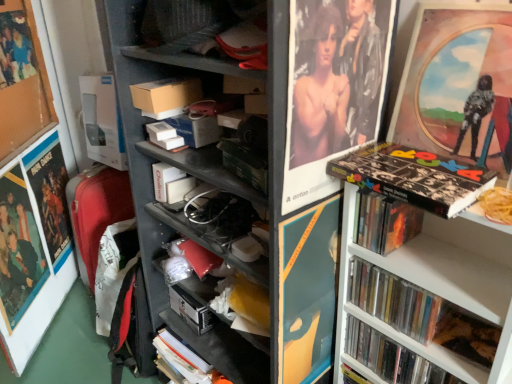
Question: Is black matte book at upper right, the third book viewed from the left, thinner than metallic silver cd case at right, positioned as the 2th book in right-to-left order?

Choices:
 (A) no
 (B) yes

Answer: (A)

Question: Can you confirm if black matte book at upper right, the third book viewed from the left, is shorter than metallic silver cd case at right, positioned as the 2th book in right-to-left order?

Choices:
 (A) no
 (B) yes

Answer: (B)

Question: Is black matte book at upper right, arranged as the 3th book when viewed from the right, wider than metallic silver cd case at right, positioned as the 2th book in right-to-left order?

Choices:
 (A) no
 (B) yes

Answer: (B)

Question: Is black matte book at upper right, the third book viewed from the left, looking in the opposite direction of metallic silver cd case at right, the 4th book in the left-to-right sequence?

Choices:
 (A) no
 (B) yes

Answer: (A)

Question: Is black matte book at upper right, the third book viewed from the left, with metallic silver cd case at right, the 4th book in the left-to-right sequence?

Choices:
 (A) no
 (B) yes

Answer: (A)

Question: Is black matte book at upper right, the third book viewed from the left, to the left or to the right of black matte book at lower right, which is the first book in right-to-left order, in the image?

Choices:
 (A) right
 (B) left

Answer: (B)

Question: Would you say black matte book at upper right, arranged as the 3th book when viewed from the right, is inside or outside black matte book at lower right, arranged as the fifth book when viewed from the left?

Choices:
 (A) outside
 (B) inside

Answer: (A)

Question: Looking at their shapes, would you say black matte book at upper right, the third book viewed from the left, is wider or thinner than black matte book at lower right, arranged as the fifth book when viewed from the left?

Choices:
 (A) thin
 (B) wide

Answer: (B)

Question: Relative to black matte book at lower right, which is the first book in right-to-left order, is black matte book at upper right, the third book viewed from the left, in front or behind?

Choices:
 (A) behind
 (B) front

Answer: (B)

Question: Is white matte book at center, marked as the 1th book in a left-to-right arrangement, inside the boundaries of black matte book at upper right, arranged as the 3th book when viewed from the right, or outside?

Choices:
 (A) outside
 (B) inside

Answer: (A)

Question: In terms of height, does white matte book at center, marked as the 1th book in a left-to-right arrangement, look taller or shorter compared to black matte book at upper right, arranged as the 3th book when viewed from the right?

Choices:
 (A) tall
 (B) short

Answer: (A)

Question: From a real-world perspective, relative to black matte book at upper right, arranged as the 3th book when viewed from the right, is white matte book at center, marked as the 1th book in a left-to-right arrangement, vertically above or below?

Choices:
 (A) above
 (B) below

Answer: (B)

Question: Is point (159, 198) closer or farther from the camera than point (425, 173)?

Choices:
 (A) farther
 (B) closer

Answer: (A)

Question: Considering the positions of matte plastic picture frame at upper right, the 2th picture frame from the left, and wooden frame poster at upper left, placed as the 3th poster page when sorted from right to left, in the image, is matte plastic picture frame at upper right, the 2th picture frame from the left, bigger or smaller than wooden frame poster at upper left, placed as the 3th poster page when sorted from right to left,?

Choices:
 (A) big
 (B) small

Answer: (A)

Question: Does point coord(456,33) appear closer or farther from the camera than point coord(30,36)?

Choices:
 (A) closer
 (B) farther

Answer: (A)